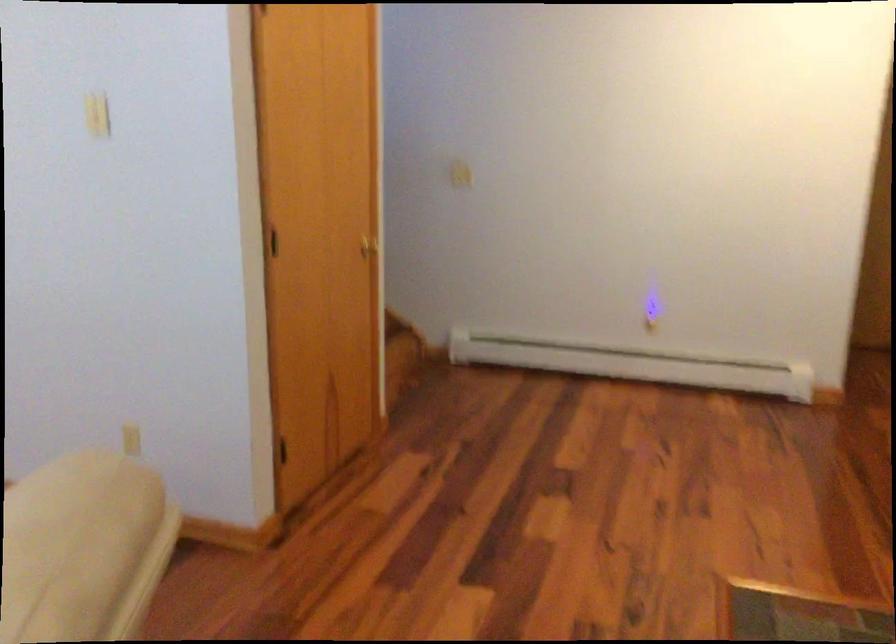
Identify the location of sofa sitting surface. (83, 547).